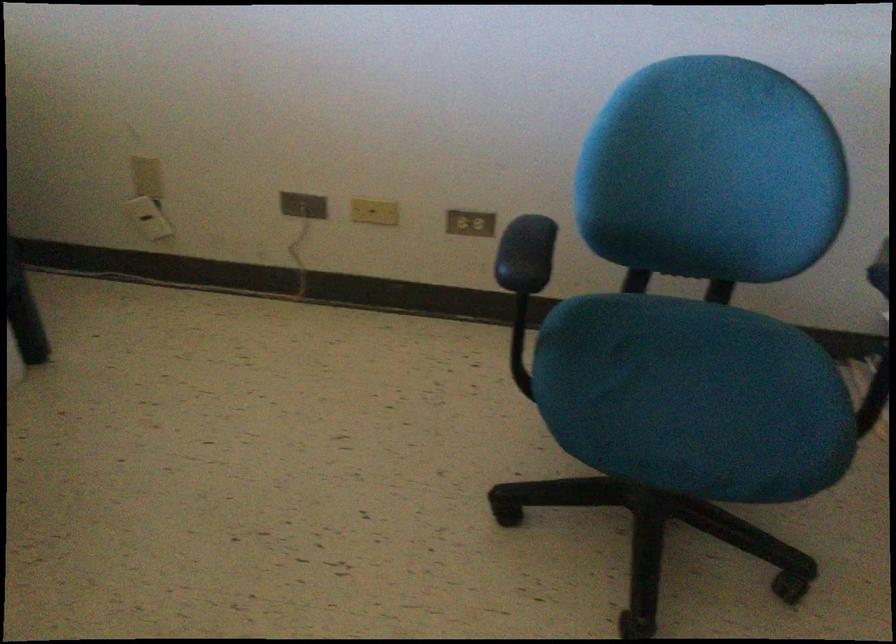
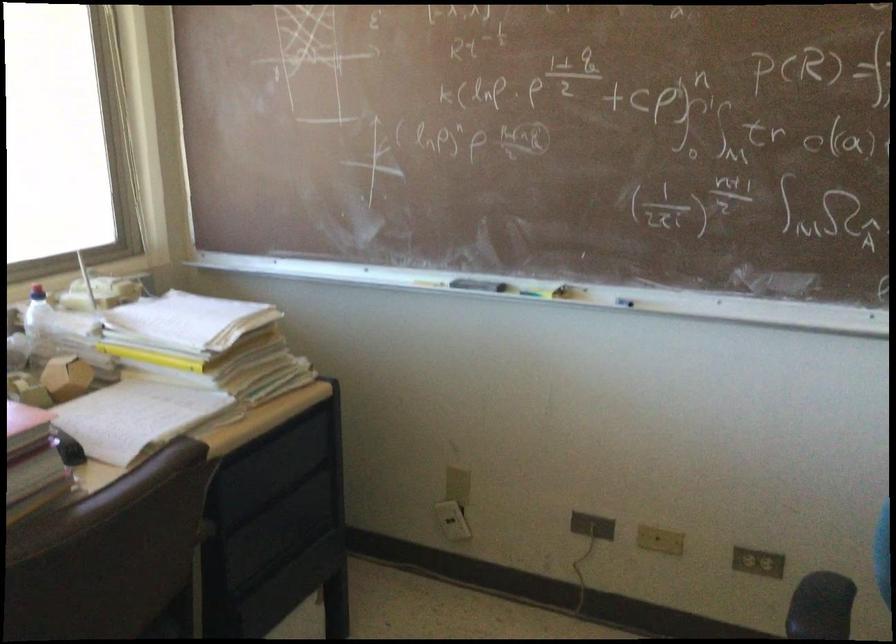
In the second image, find the point that corresponds to the point at 142,219 in the first image.

(452, 520)